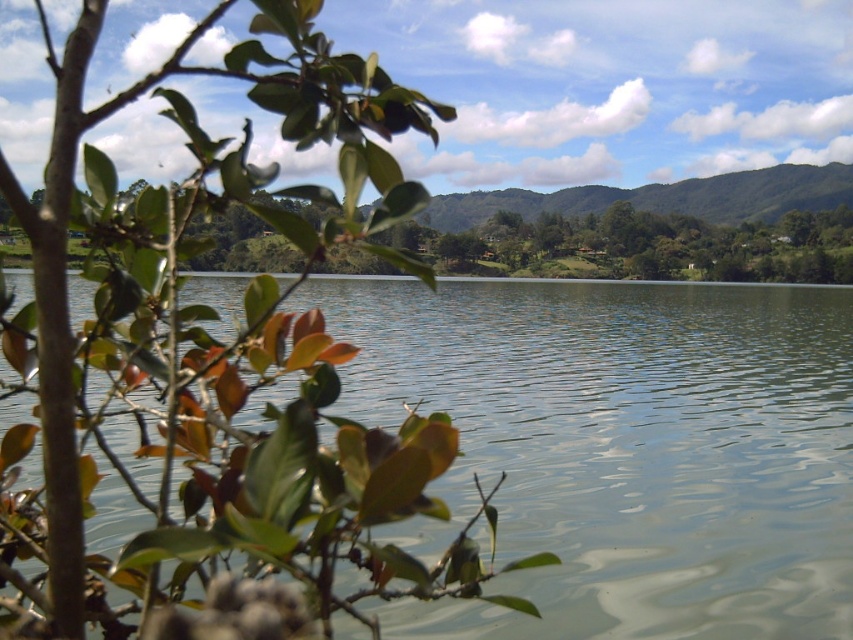
You are standing at the edge of the lake and notice two features in the scene. One is the green glossy leaves at left and the other is the green smooth water at center. Which of these two features is positioned more to the left side of the image?

The green glossy leaves at left are positioned more to the left side of the image compared to the green smooth water at center.

You are an artist sketching the scene. You need to decide which object to draw first based on their widths. Which is narrower, the green glossy leaves at left or the green smooth water at center?

The green glossy leaves at left is thinner than the green smooth water at center, so the green glossy leaves at left is narrower and should be drawn first.